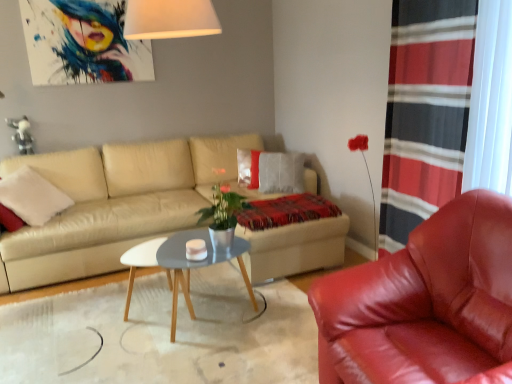
Measure the distance between gray wooden coffee table at center and camera.

gray wooden coffee table at center and camera are 2.25 meters apart from each other.

You are a GUI agent. You are given a task and a screenshot of the screen. Output one action in this format:
    pyautogui.click(x=<x>, y=<y>)
    Task: Click on the gray wooden coffee table at center
    The image size is (512, 384).
    Given the screenshot: What is the action you would take?
    pyautogui.click(x=181, y=265)

What is the approximate width of beige leather couch at center?

beige leather couch at center is 1.69 meters in width.

This screenshot has height=384, width=512. Find the location of `red striped curtain at right`. red striped curtain at right is located at coordinates (425, 112).

Could you tell me if plaid woolen blanket at center is turned towards beige leather couch at center?

Yes, plaid woolen blanket at center is oriented towards beige leather couch at center.

Who is bigger, plaid woolen blanket at center or beige leather couch at center?

With larger size is beige leather couch at center.

Measure the distance from plaid woolen blanket at center to beige leather couch at center.

They are 39.02 inches apart.

Are plaid woolen blanket at center and beige leather couch at center far apart?

No.

Looking at the image, does red striped curtain at right seem bigger or smaller compared to gray wooden coffee table at center?

red striped curtain at right is bigger than gray wooden coffee table at center.

From the picture: From the image's perspective, between red striped curtain at right and gray wooden coffee table at center, which one is located above?

red striped curtain at right is shown above in the image.

Between point (113, 245) and point (335, 341), which one is positioned in front?

The point (335, 341) is closer to the camera.

Is beige leather couch at center outside of shiny red leather armchair at right?

Yes, beige leather couch at center is located beyond the bounds of shiny red leather armchair at right.

Is beige leather couch at center beside shiny red leather armchair at right?

No, beige leather couch at center is not touching shiny red leather armchair at right.

Looking at their sizes, would you say beige leather couch at center is wider or thinner than shiny red leather armchair at right?

In the image, beige leather couch at center appears to be wider than shiny red leather armchair at right.

In the scene shown: Is gray wooden coffee table at center bigger than plaid woolen blanket at center?

Correct, gray wooden coffee table at center is larger in size than plaid woolen blanket at center.

Looking at this image, from the image's perspective, which one is positioned lower, gray wooden coffee table at center or plaid woolen blanket at center?

gray wooden coffee table at center is shown below in the image.

Does gray wooden coffee table at center appear on the right side of plaid woolen blanket at center?

No, gray wooden coffee table at center is not to the right of plaid woolen blanket at center.

Are shiny red leather armchair at right and beige leather couch at center located far from each other?

shiny red leather armchair at right is positioned a significant distance from beige leather couch at center.

Considering the relative positions of shiny red leather armchair at right and beige leather couch at center in the image provided, is shiny red leather armchair at right to the left of beige leather couch at center from the viewer's perspective?

No, shiny red leather armchair at right is not to the left of beige leather couch at center.

From a real-world perspective, which object rests below the other?

In real-world perspective, shiny red leather armchair at right is lower.

From the image's perspective, which object appears higher, beige leather couch at center or red striped curtain at right?

red striped curtain at right.

Would you say beige leather couch at center is inside or outside red striped curtain at right?

beige leather couch at center is located beyond the bounds of red striped curtain at right.

Is beige leather couch at center positioned behind red striped curtain at right?

Yes, beige leather couch at center is behind red striped curtain at right.

Is shiny red leather armchair at right situated inside gray wooden coffee table at center or outside?

shiny red leather armchair at right is outside gray wooden coffee table at center.

How many degrees apart are the facing directions of shiny red leather armchair at right and gray wooden coffee table at center?

The facing directions of shiny red leather armchair at right and gray wooden coffee table at center are 92 degrees apart.

Can you confirm if shiny red leather armchair at right is thinner than gray wooden coffee table at center?

Incorrect, the width of shiny red leather armchair at right is not less than that of gray wooden coffee table at center.

I want to click on studio couch below the plaid woolen blanket at center (from a real-world perspective), so click(x=116, y=204).

The height and width of the screenshot is (384, 512). Identify the location of curtain lying in front of the gray wooden coffee table at center. (425, 112).

Estimate the real-world distances between objects in this image. Which object is further from gray wooden coffee table at center, plaid woolen blanket at center or shiny red leather armchair at right?

Among the two, shiny red leather armchair at right is located further to gray wooden coffee table at center.

When comparing their distances from beige leather couch at center, does red striped curtain at right or gray wooden coffee table at center seem further?

Among the two, red striped curtain at right is located further to beige leather couch at center.

From the image, which object appears to be nearer to red striped curtain at right, shiny red leather armchair at right or plaid woolen blanket at center?

shiny red leather armchair at right is closer to red striped curtain at right.

Estimate the real-world distances between objects in this image. Which object is further from shiny red leather armchair at right, beige leather couch at center or red striped curtain at right?

The object further to shiny red leather armchair at right is beige leather couch at center.

When comparing their distances from shiny red leather armchair at right, does beige leather couch at center or plaid woolen blanket at center seem closer?

plaid woolen blanket at center.

From the picture: Which object lies nearer to the anchor point plaid woolen blanket at center, beige leather couch at center or shiny red leather armchair at right?

beige leather couch at center lies closer to plaid woolen blanket at center than the other object.

Considering their positions, is beige leather couch at center positioned further to plaid woolen blanket at center than red striped curtain at right?

beige leather couch at center is positioned further to the anchor plaid woolen blanket at center.

Looking at the image, which one is located closer to red striped curtain at right, beige leather couch at center or gray wooden coffee table at center?

gray wooden coffee table at center lies closer to red striped curtain at right than the other object.

Find the location of a particular element. coffee table between beige leather couch at center and red striped curtain at right is located at coordinates (181, 265).

This screenshot has height=384, width=512. I want to click on curtain located between shiny red leather armchair at right and plaid woolen blanket at center in the depth direction, so click(425, 112).

Find the location of a particular element. coffee table between beige leather couch at center and shiny red leather armchair at right from left to right is located at coordinates 181,265.

The image size is (512, 384). I want to click on blanket situated between beige leather couch at center and red striped curtain at right from left to right, so click(286, 211).